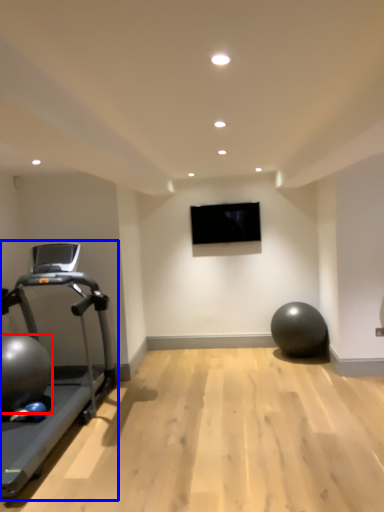
Question: Among these objects, which one is nearest to the camera, ball (highlighted by a red box) or treadmill (highlighted by a blue box)?

Choices:
 (A) ball
 (B) treadmill

Answer: (B)